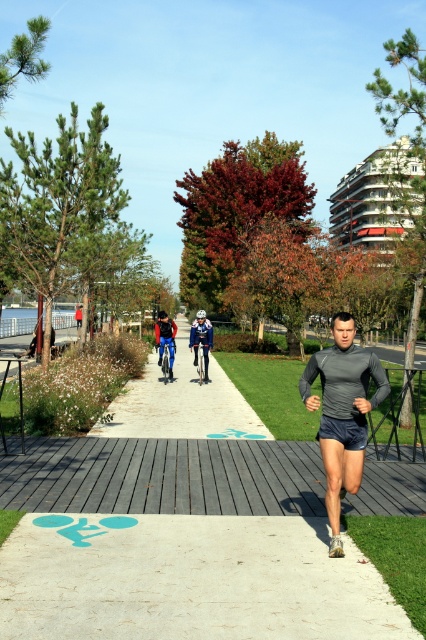
Question: Which point is closer to the camera?

Choices:
 (A) (348, 442)
 (B) (192, 368)

Answer: (A)

Question: Is blue fabric at center wider than dark gray/charcoal running suit at center?

Choices:
 (A) no
 (B) yes

Answer: (B)

Question: Which of the following is the closest to the observer?

Choices:
 (A) (345, 372)
 (B) (126, 394)

Answer: (A)

Question: Does blue fabric at center appear under dark gray/charcoal running suit at center?

Choices:
 (A) yes
 (B) no

Answer: (A)

Question: Which point is farther to the camera?

Choices:
 (A) dark gray/charcoal running suit at center
 (B) blue fabric at center

Answer: (B)

Question: Is blue fabric at center above dark gray/charcoal running suit at center?

Choices:
 (A) no
 (B) yes

Answer: (A)